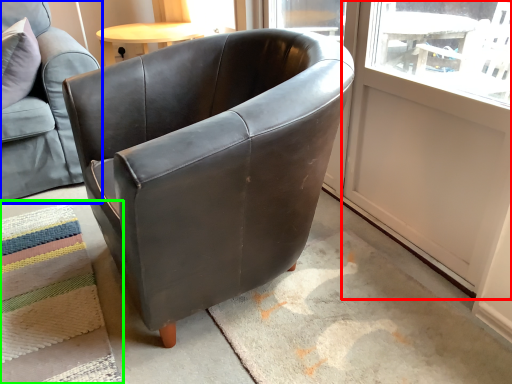
Question: Which is farther away from screen door (highlighted by a red box)? chair (highlighted by a blue box) or mat (highlighted by a green box)?

Choices:
 (A) chair
 (B) mat

Answer: (A)